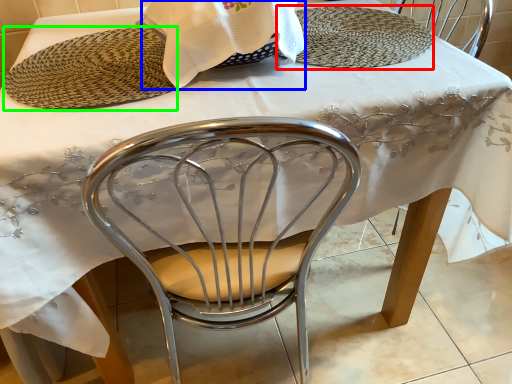
Question: Which object is positioned closest to plate (highlighted by a red box)? Select from blanket (highlighted by a blue box) and platter (highlighted by a green box).

Choices:
 (A) blanket
 (B) platter

Answer: (A)